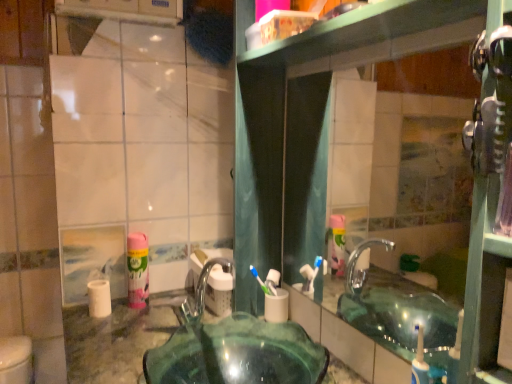
Find the location of a particular element. Image resolution: width=512 pixels, height=384 pixels. free point in front of white matte toilet paper at left, which is the second toilet paper from right to left is located at coordinates (97, 335).